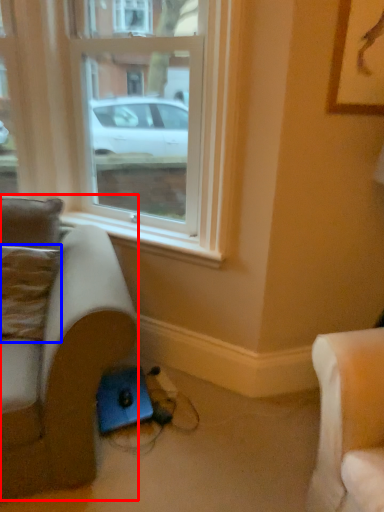
Question: Among these objects, which one is farthest to the camera, studio couch (highlighted by a red box) or pillow (highlighted by a blue box)?

Choices:
 (A) studio couch
 (B) pillow

Answer: (B)